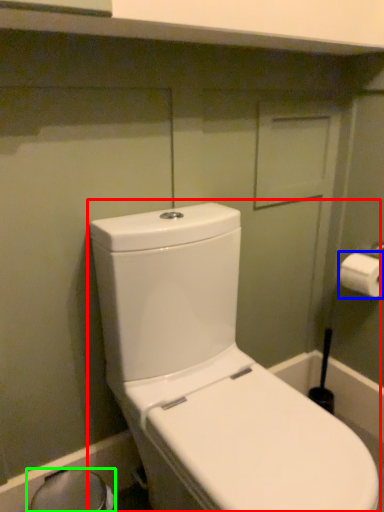
Question: Considering the real-world distances, which object is farthest from toilet (highlighted by a red box)? toilet paper (highlighted by a blue box) or bidet (highlighted by a green box)?

Choices:
 (A) toilet paper
 (B) bidet

Answer: (A)